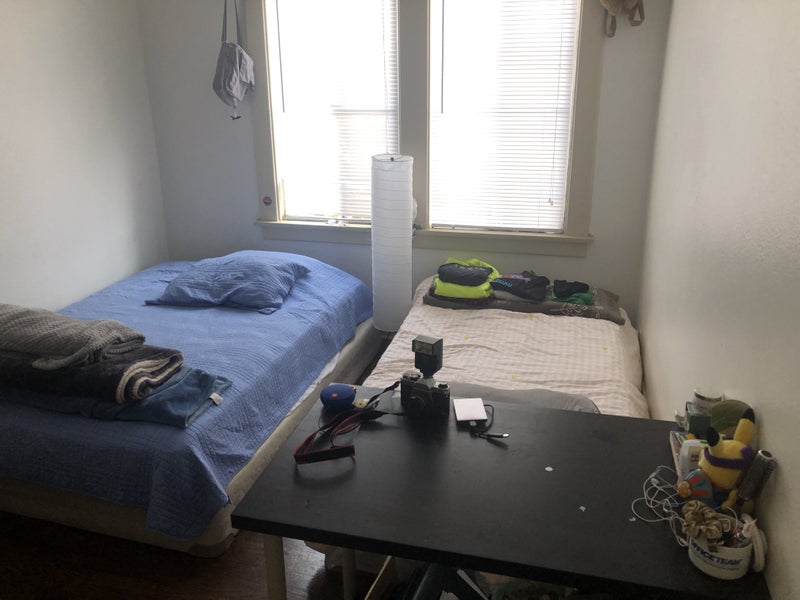
Locate an element on the screen. The height and width of the screenshot is (600, 800). pillows is located at coordinates (253, 275), (560, 395).